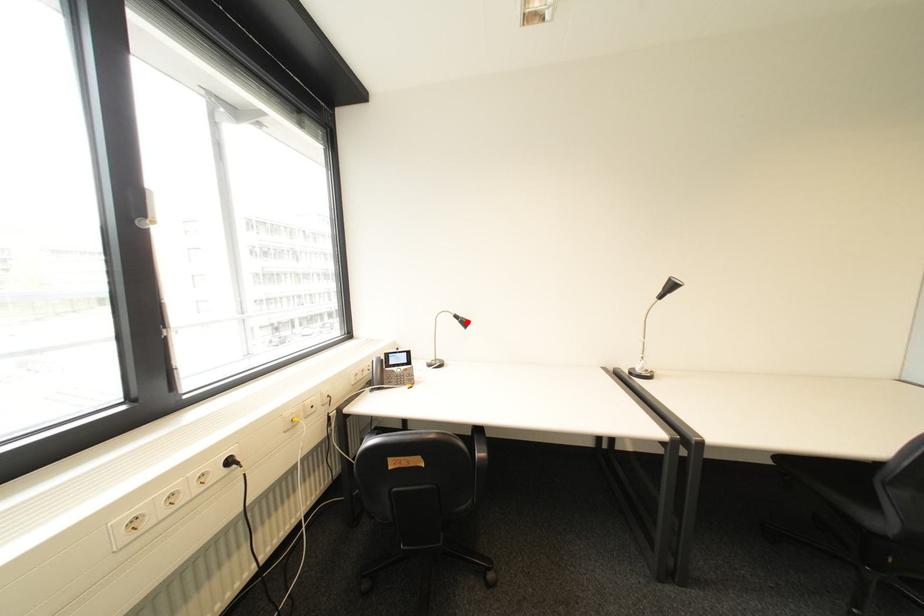
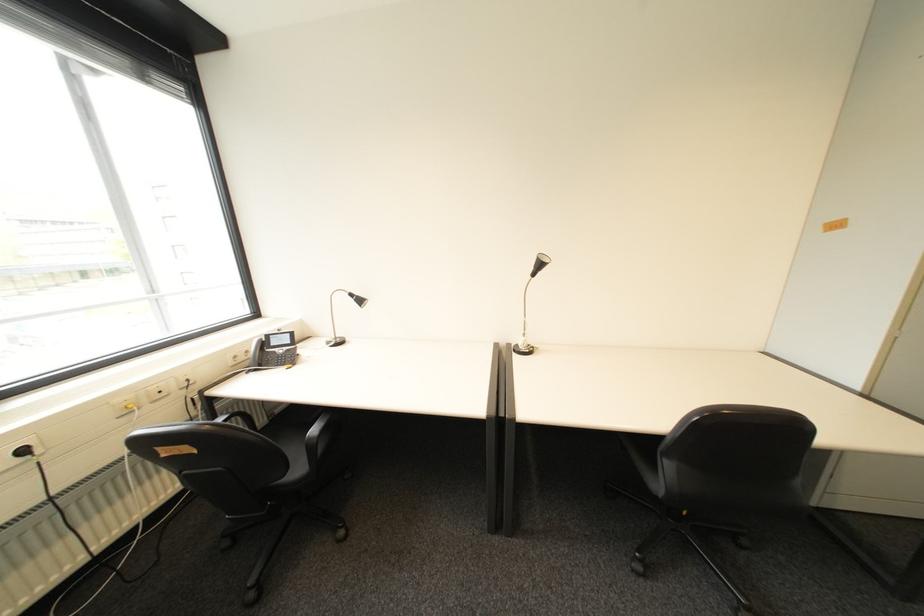
Find the pixel in the second image that matches the highlighted location in the first image.

(362, 301)